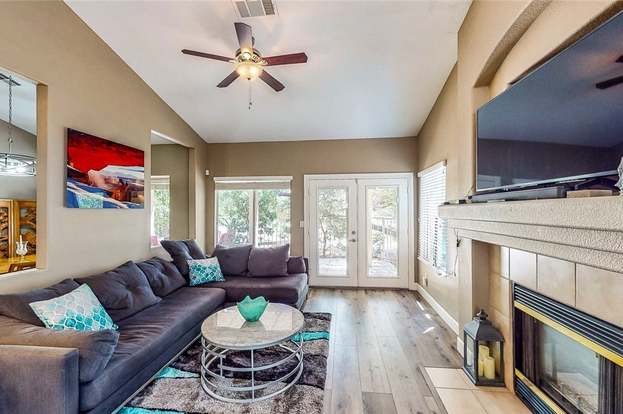
Locate an element on the screen. The height and width of the screenshot is (414, 623). hanging picture is located at coordinates (130, 166).